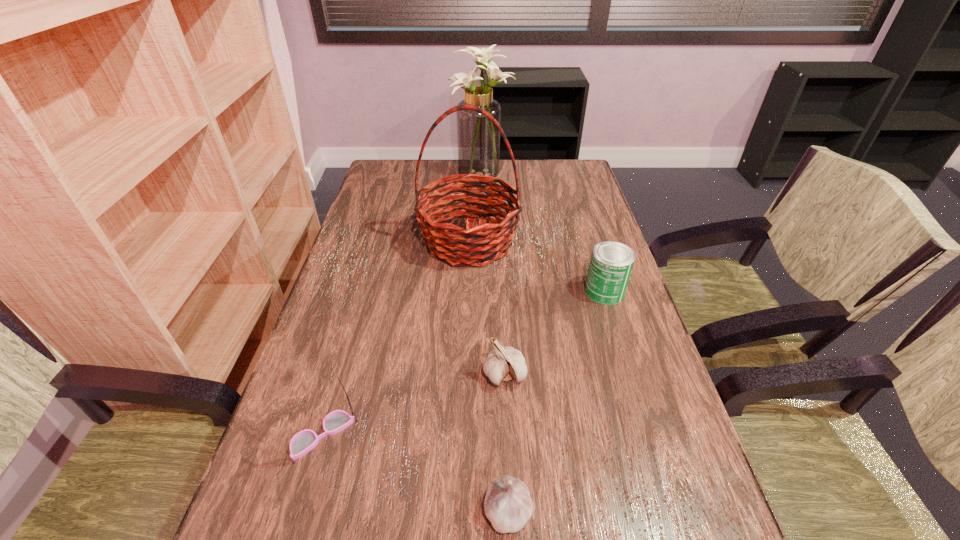
The height and width of the screenshot is (540, 960). I want to click on vacant space that satisfies the following two spatial constraints: 1. on the front side of the basket; 2. on the left side of the farther garlic, so click(465, 374).

The height and width of the screenshot is (540, 960). I want to click on vacant space that satisfies the following two spatial constraints: 1. on the back side of the second nearest object; 2. on the right side of the farther garlic, so click(x=340, y=374).

At what (x,y) coordinates should I click in order to perform the action: click on free location that satisfies the following two spatial constraints: 1. on the back side of the can; 2. on the right side of the nearest object. Please return your answer as a coordinate pair (x, y). Looking at the image, I should click on (498, 292).